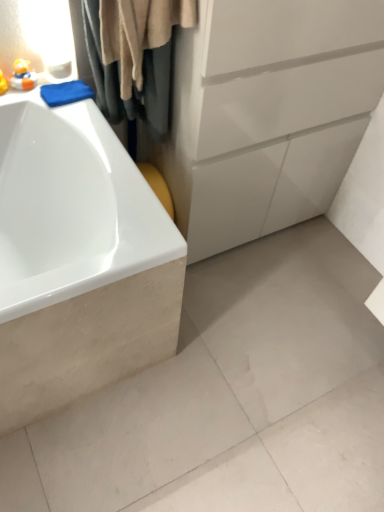
Question: From the image's perspective, is white matte concrete at lower left positioned above or below matte yellow rubber duck at upper left, which is the 1th toy from right to left?

Choices:
 (A) below
 (B) above

Answer: (A)

Question: Relative to matte yellow rubber duck at upper left, which is the 1th toy from right to left, is white matte concrete at lower left in front or behind?

Choices:
 (A) front
 (B) behind

Answer: (A)

Question: Which is farther from the matte yellow rubber duck at upper left, positioned as the second toy in right-to-left order?

Choices:
 (A) white matte concrete at lower left
 (B) beige fabric shower curtain at upper left
 (C) white glossy bathtub at left
 (D) matte yellow rubber duck at upper left, which is the second toy in left-to-right order

Answer: (A)

Question: Which object is positioned closest to the matte yellow rubber duck at upper left, positioned as the second toy in right-to-left order?

Choices:
 (A) beige fabric shower curtain at upper left
 (B) white glossy bathtub at left
 (C) matte yellow rubber duck at upper left, which is the second toy in left-to-right order
 (D) white matte concrete at lower left

Answer: (C)